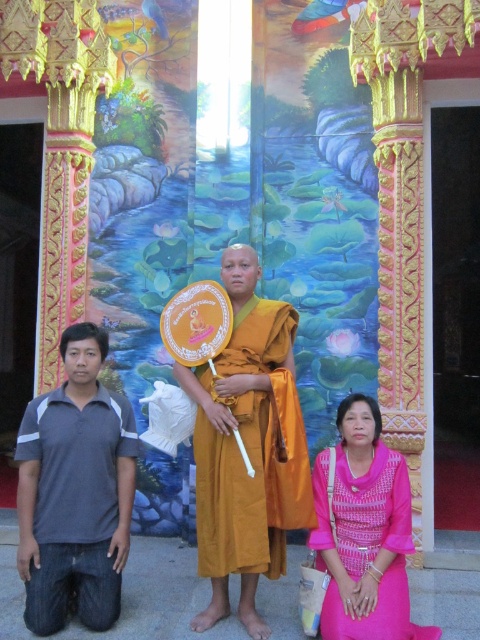
Question: Is orange silk robe at center further to the viewer compared to pink woven fabric at center?

Choices:
 (A) no
 (B) yes

Answer: (B)

Question: Among these objects, which one is farthest from the camera?

Choices:
 (A) orange silk robe at center
 (B) gray cotton polo shirt at lower left
 (C) pink woven fabric at center

Answer: (A)

Question: Is orange silk robe at center below pink woven fabric at center?

Choices:
 (A) no
 (B) yes

Answer: (A)

Question: Which of these objects is positioned farthest from the gray cotton polo shirt at lower left?

Choices:
 (A) pink woven fabric at center
 (B) orange silk robe at center

Answer: (A)

Question: Which point is farther to the camera?

Choices:
 (A) gray cotton polo shirt at lower left
 (B) orange silk robe at center

Answer: (B)

Question: From the image, what is the correct spatial relationship of gray cotton polo shirt at lower left in relation to pink woven fabric at center?

Choices:
 (A) below
 (B) above

Answer: (B)